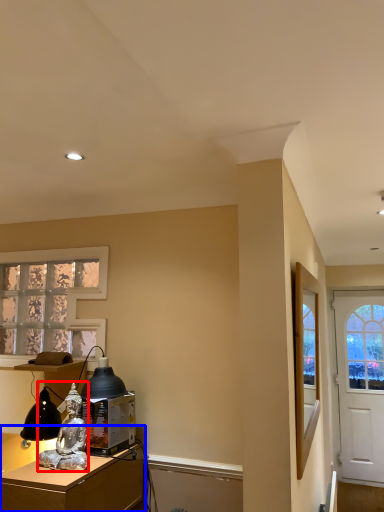
Question: Which point is closer to the camera, person (highlighted by a red box) or desk (highlighted by a blue box)?

Choices:
 (A) person
 (B) desk

Answer: (B)